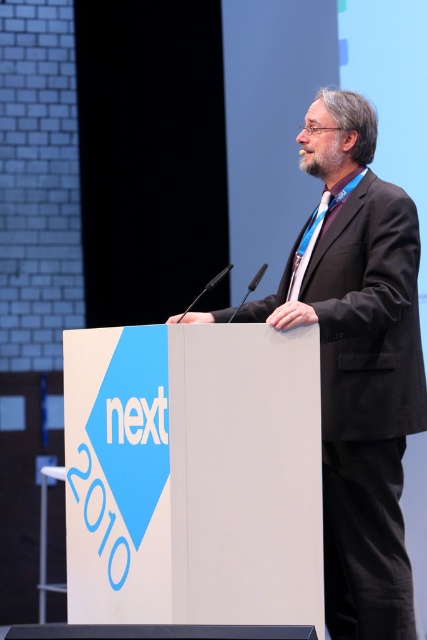
Question: Does black suit at center appear on the left side of blue silk tie at center?

Choices:
 (A) no
 (B) yes

Answer: (B)

Question: Can you confirm if black suit at center is positioned to the left of blue silk tie at center?

Choices:
 (A) yes
 (B) no

Answer: (A)

Question: Can you confirm if black suit at center is positioned to the left of blue silk tie at center?

Choices:
 (A) no
 (B) yes

Answer: (B)